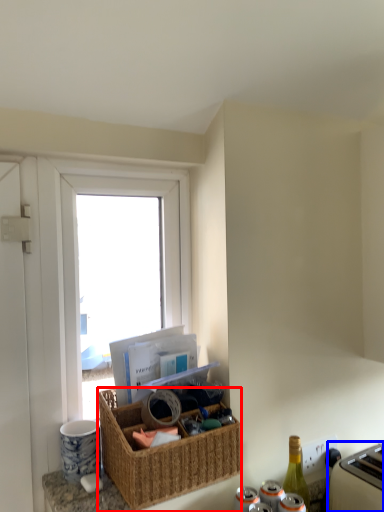
Question: Which point is further to the camera, picnic basket (highlighted by a red box) or appliance (highlighted by a blue box)?

Choices:
 (A) picnic basket
 (B) appliance

Answer: (B)